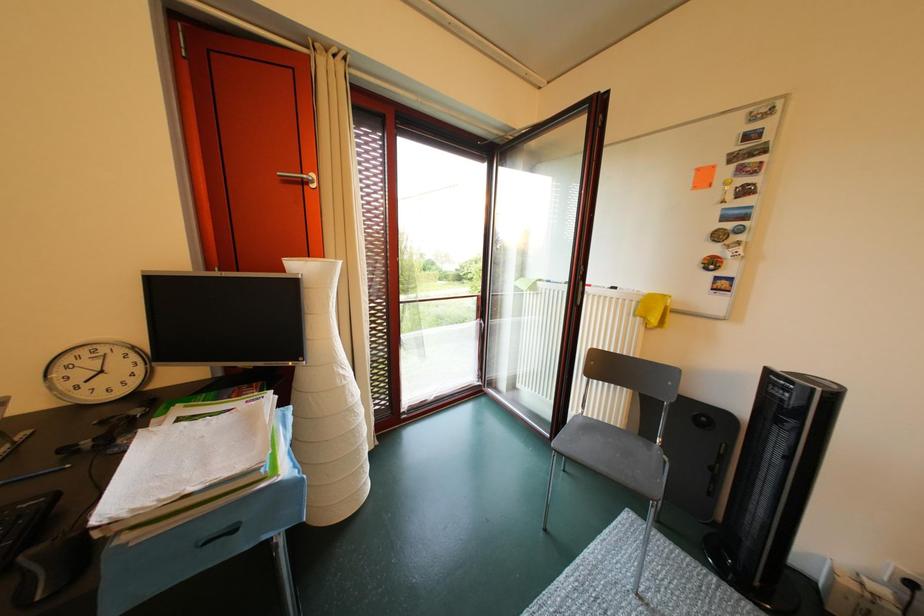
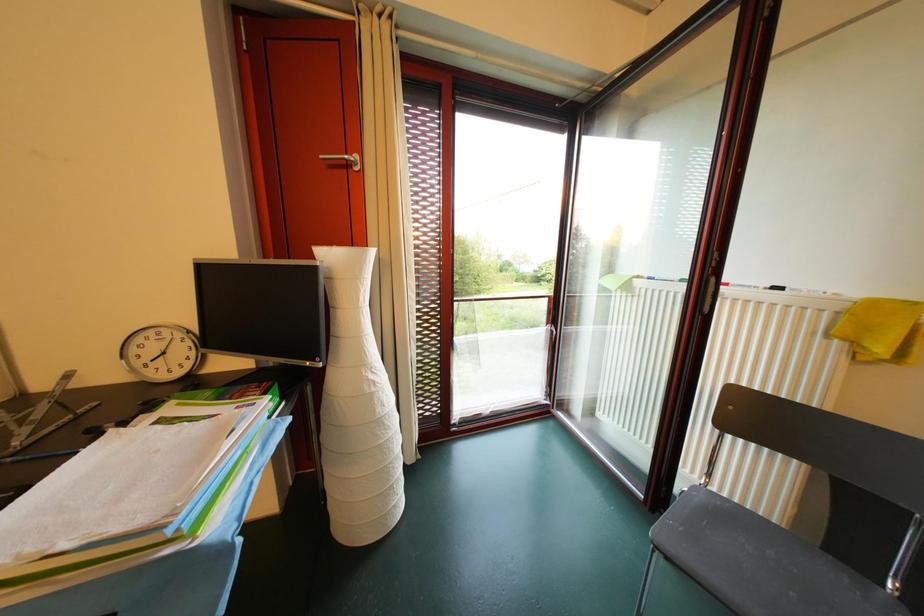
Question: The camera is either moving clockwise (left) or counter-clockwise (right) around the object. The first image is from the beginning of the video and the second image is from the end. Is the camera moving left or right when shooting the video?

Choices:
 (A) Left
 (B) Right

Answer: (B)